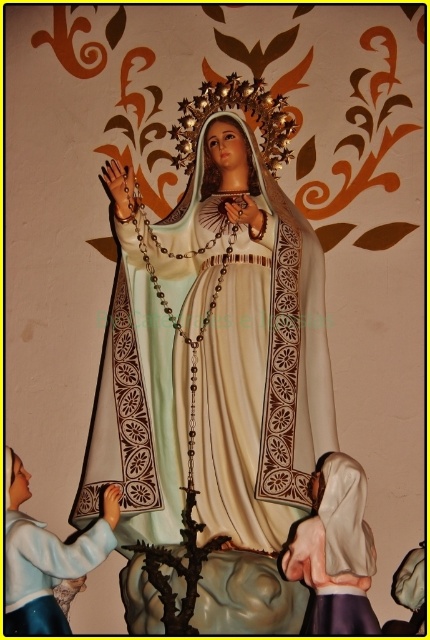
Question: Does matte gold statue at center have a lesser width compared to white satin robe at lower left?

Choices:
 (A) no
 (B) yes

Answer: (A)

Question: Is matte gold statue at center positioned in front of white satin robe at lower left?

Choices:
 (A) no
 (B) yes

Answer: (A)

Question: Which point is closer to the camera?

Choices:
 (A) matte gold statue at center
 (B) white satin robe at lower left

Answer: (B)

Question: Which point is closer to the camera?

Choices:
 (A) (79, 552)
 (B) (187, 308)

Answer: (A)

Question: Can you confirm if matte gold statue at center is positioned above white satin robe at lower left?

Choices:
 (A) no
 (B) yes

Answer: (B)